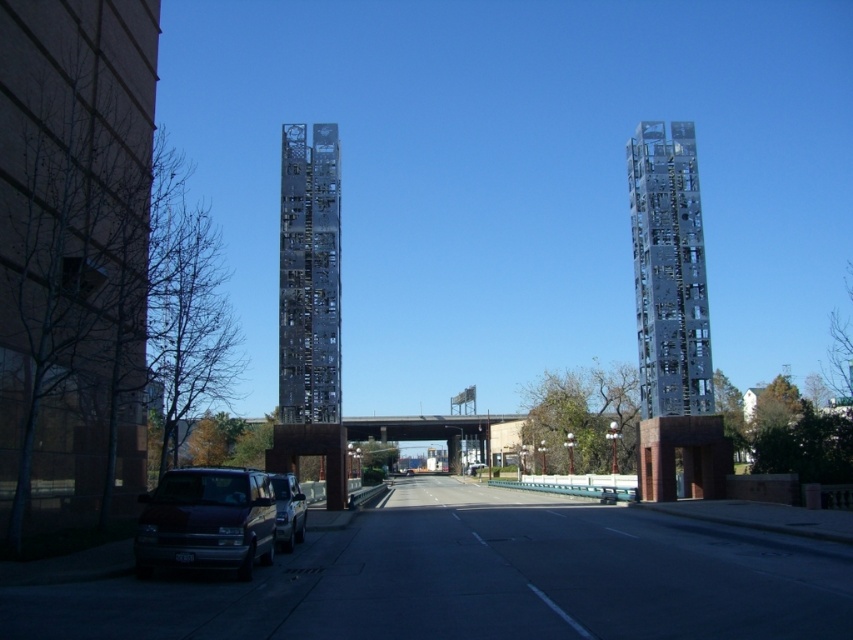
You are a delivery driver approaching the bridge in the urban scene. You need to navigate around the metallic grid structure at center. Based on its position, which direction should you steer your vehicle to avoid it?

The metallic grid structure at center is located at point coordinates, so you should steer your vehicle either to the left or right to avoid it while staying on the road.

You are driving a delivery truck and need to pass under the metallic grid structure at center. The truck is 4 meters tall. Can you safely drive under it without hitting the structure, considering the metallic silver suv at lower left is parked underneath it?

The metallic grid structure at center is positioned over the metallic silver suv at lower left, which means the structure is at least as tall as the SUV. Since SUVs typically have a height of around 1.7 to 2 meters, the structure likely has a clearance higher than that. However, since the truck is 4 meters tall, it exceeds the typical SUV height. Without exact measurements, it is risky to assume clearance. To be safe, avoid driving under the metallic grid structure at center with the delivery truck.

You are a city planner analyzing the urban layout. Given the coordinates of the metallic grid structure at center, how would you describe its position relative to the road and the surrounding sculptures?

The metallic grid structure at center is positioned at coordinates 0.431 on the x and 0.363 on the y axis, placing it centrally along the road amidst the tall modern sculptures on both sides.